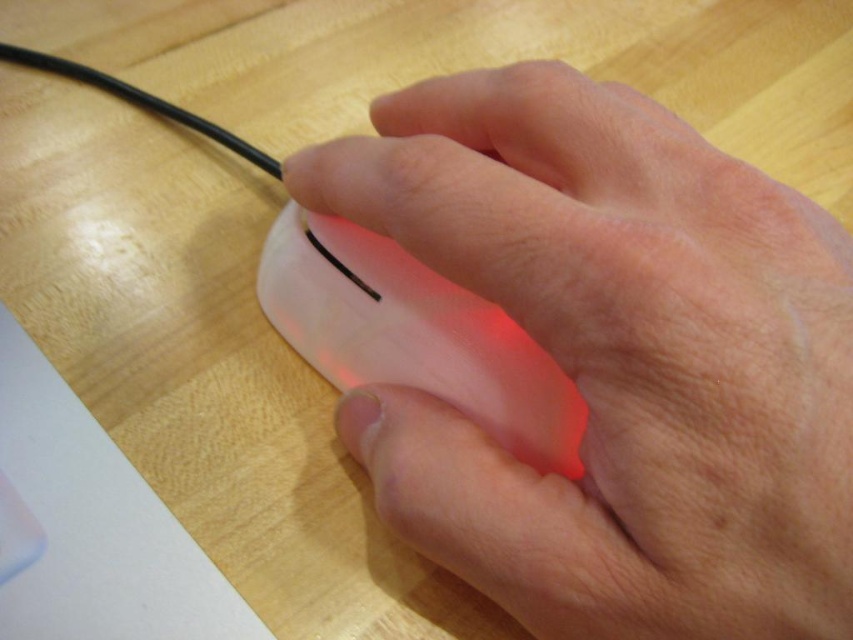
Is white matte mouse at center shorter than translucent plastic mouse at center?

No, white matte mouse at center is not shorter than translucent plastic mouse at center.

How far apart are white matte mouse at center and translucent plastic mouse at center?

white matte mouse at center is 2.18 inches away from translucent plastic mouse at center.

This screenshot has width=853, height=640. Identify the location of white matte mouse at center. 614,358.

The height and width of the screenshot is (640, 853). What are the coordinates of `white matte mouse at center` in the screenshot? It's located at (614, 358).